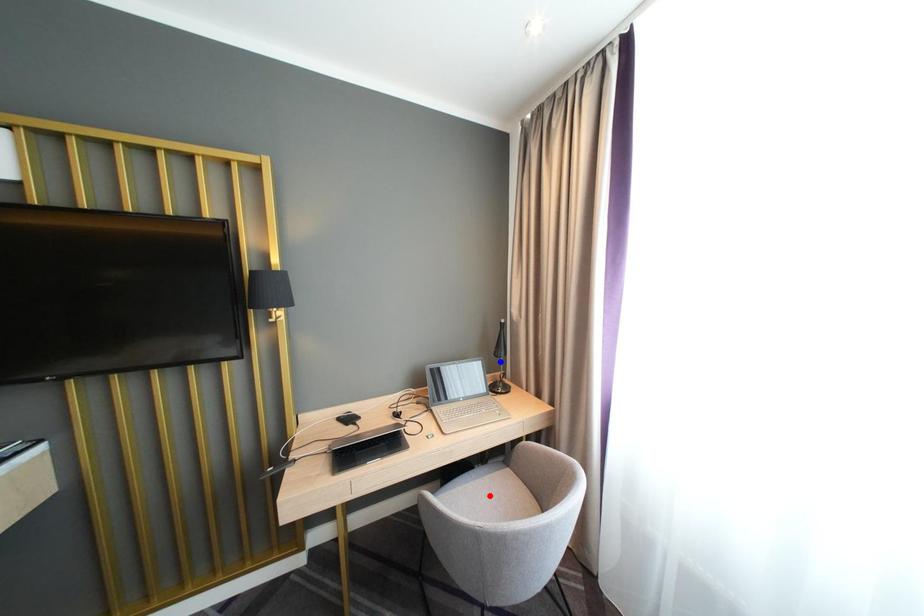
Question: Which of the two points in the image is closer to the camera?

Choices:
 (A) Blue point is closer.
 (B) Red point is closer.

Answer: (B)